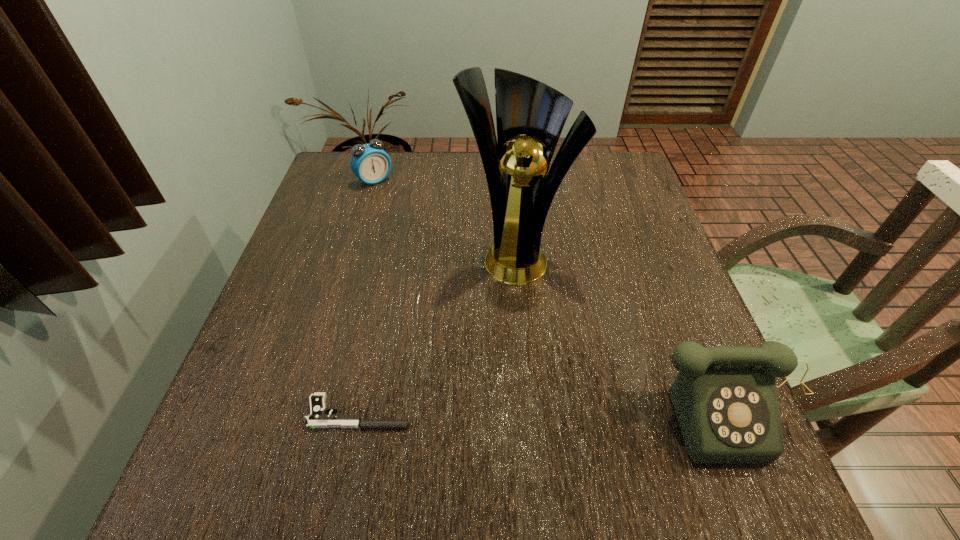
What are the coordinates of `free space on the desktop that is between the shortest object and the telephone and is positioned at the front of the tallest object, where the globe is visible` in the screenshot? It's located at (504, 411).

Locate an element on the screen. vacant space on the desktop that is between the pistol and the telephone and is positioned on the face of the farthest object is located at coordinates (592, 410).